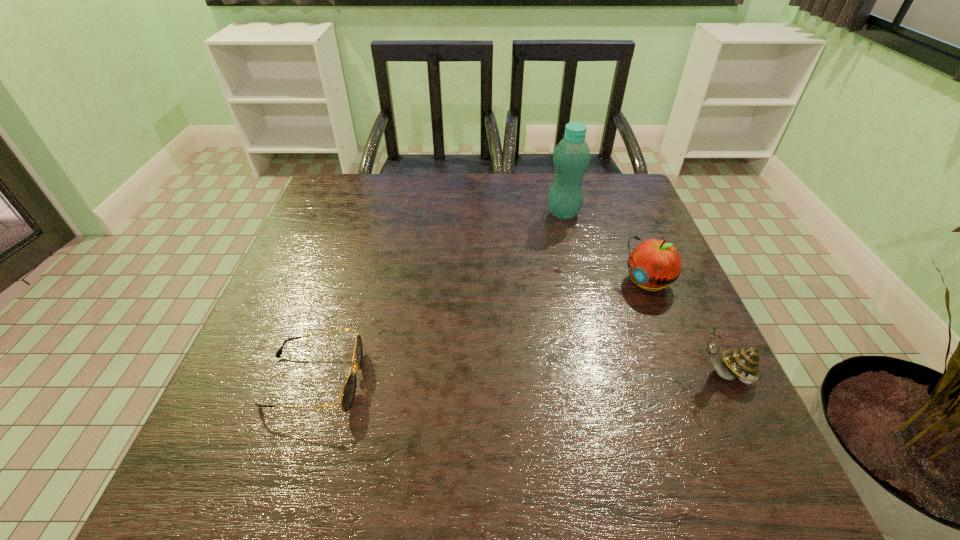
This screenshot has width=960, height=540. I want to click on free space located at the front cap of the third object from right to left, so click(541, 254).

The image size is (960, 540). Find the location of `blank area located at the front cap of the third object from right to left`. blank area located at the front cap of the third object from right to left is located at coordinates (504, 323).

In order to click on free location located 0.290m at the front cap of the third object from right to left in this screenshot , I will do `click(521, 290)`.

This screenshot has height=540, width=960. I want to click on blank space located 0.140m on the surface of the apple, so click(591, 323).

This screenshot has height=540, width=960. Identify the location of vacant space located 0.370m on the surface of the apple. (512, 382).

The image size is (960, 540). I want to click on vacant point located on the surface of the apple, so click(604, 314).

In order to click on object positioned at the far edge in this screenshot , I will do `click(571, 157)`.

Where is `sunglasses at the near edge`? The image size is (960, 540). sunglasses at the near edge is located at coordinates (348, 393).

What are the coordinates of `snail present at the near edge` in the screenshot? It's located at (743, 364).

Where is `object present at the left edge`? object present at the left edge is located at coordinates (348, 393).